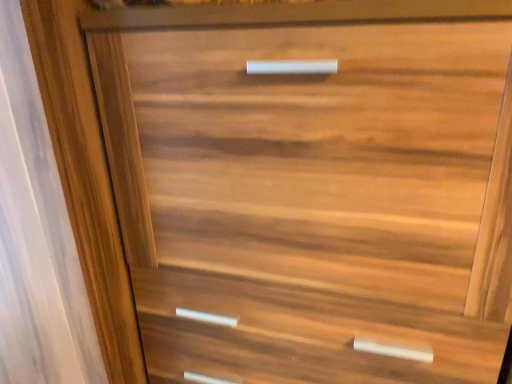
Image resolution: width=512 pixels, height=384 pixels. Identify the location of wooden panel at left. (36, 236).

What do you see at coordinates (36, 236) in the screenshot? Image resolution: width=512 pixels, height=384 pixels. I see `wooden panel at left` at bounding box center [36, 236].

Locate an element on the screen. wooden panel at left is located at coordinates (36, 236).